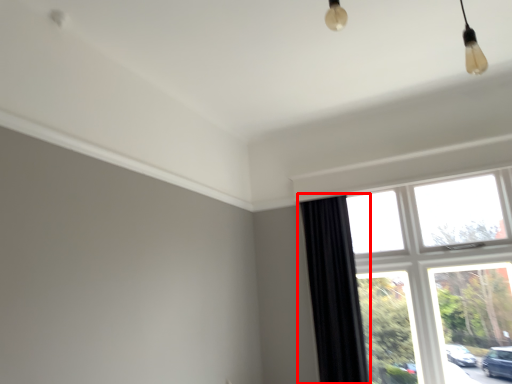
Question: Where is curtain (annotated by the red box) located in relation to window in the image?

Choices:
 (A) right
 (B) left

Answer: (B)